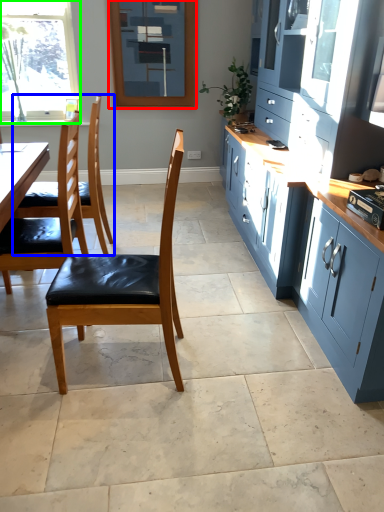
Question: Which object is positioned farthest from window screen (highlighted by a red box)? Select from chair (highlighted by a blue box) and window (highlighted by a green box).

Choices:
 (A) chair
 (B) window

Answer: (A)